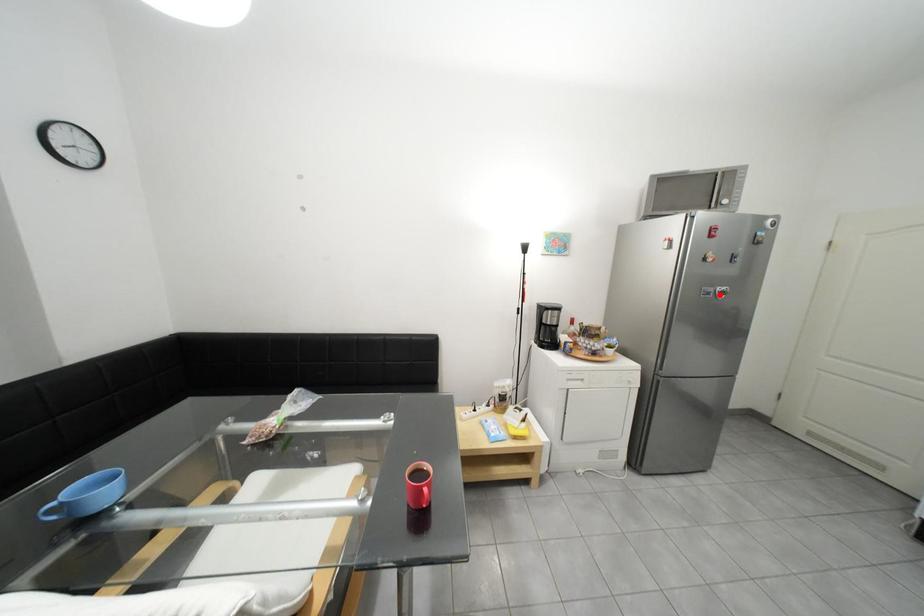
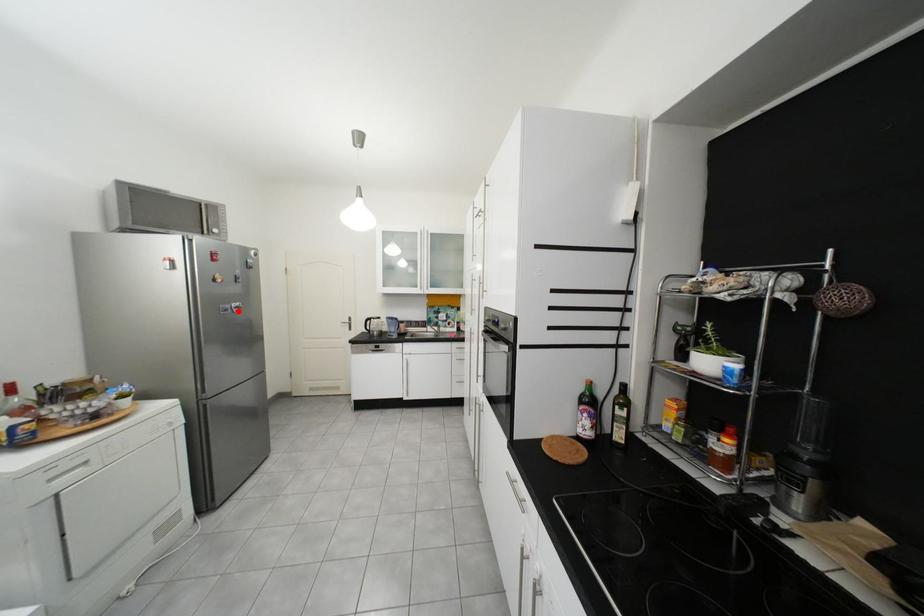
I am providing you with two images of the same scene from different viewpoints. A red point is marked on the first image and another point is marked on the second image. Does the point marked in image1 correspond to the same location as the one in image2?

Yes